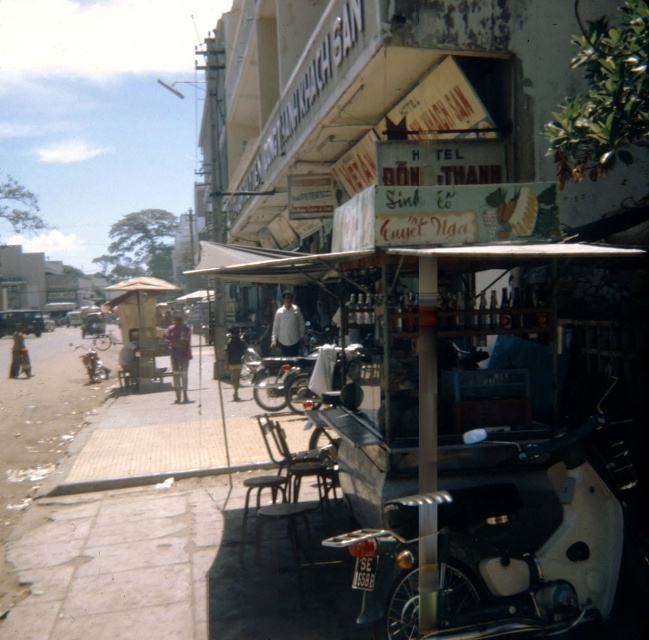
You are a delivery person standing at the entrance of the food stall. You need to deliver two packages to customers sitting at the white shirt at center and the dark blue shirt at center. The packages are 1.5 meters in length each. Can you carry both packages horizontally between the two shirts without bending them?

The distance between the white shirt at center and the dark blue shirt at center is 1.67 meters. Since each package is 1.5 meters long, placing them side by side would require a space of at least 3 meters, which exceeds the available distance. However, if you stack them vertically, the total height might be manageable, but the question specifies carrying them horizontally. Therefore, it would not be possible to carry both packages horizontally between the two shirts without bending them.

You are a customer at the food stall and want to buy both items. The vendor asks if you want to place the white shirt at center into the light brown leather jacket at lower left. Is this possible based on their sizes?

The white shirt at center is smaller than the light brown leather jacket at lower left, so yes, the shirt can fit inside the jacket.